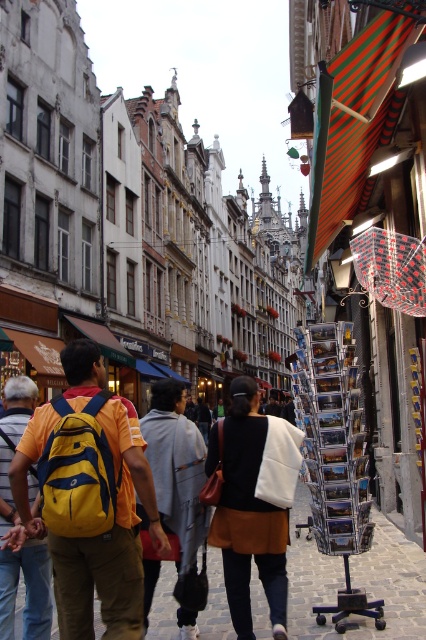
You are a tourist standing at the entrance of the street scene. You see a yellow fabric backpack at center and a white cotton jacket at center. How far apart are these two items from each other?

The yellow fabric backpack at center is 7.44 meters from the white cotton jacket at center.

You are a delivery person carrying a gray cotton hoodie at center and need to place it on the brown cobblestone pavement at center. Can you confirm if the pavement is wide enough to accommodate the hoodie?

The brown cobblestone pavement at center might be wider than gray cotton hoodie at center, so it is likely wide enough to place the hoodie there.

In the scene shown: You are standing at the point with coordinates point (155, 458) and want to walk to the point with coordinates point (299, 556). Which direction should you move in to reach your destination?

To reach point (299, 556) from point (155, 458), you should move towards the direction where point (299, 556) is located behind point (155, 458).